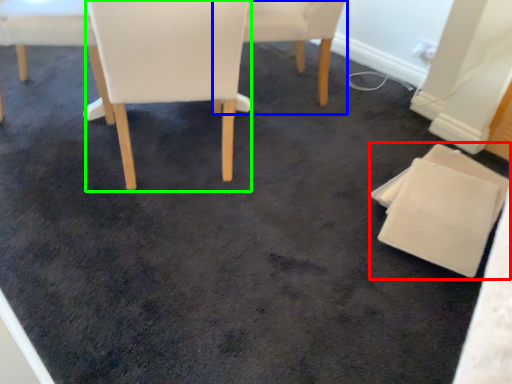
Question: Considering the real-world distances, which object is closest to chair (highlighted by a red box)? chair (highlighted by a blue box) or chair (highlighted by a green box).

Choices:
 (A) chair
 (B) chair

Answer: (B)